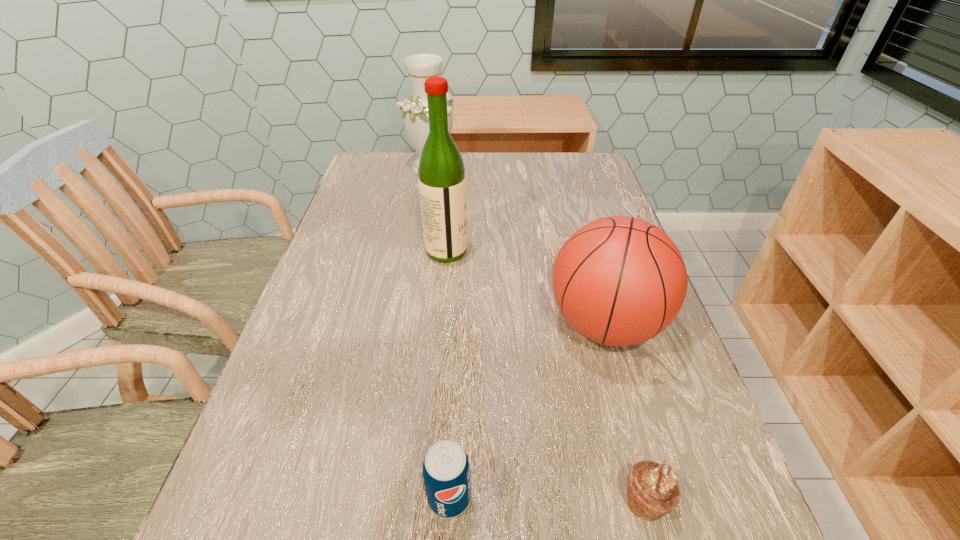
At what (x,y) coordinates should I click in order to perform the action: click on blank region between the tallest object and the pop. Please return your answer as a coordinate pair (x, y). Image resolution: width=960 pixels, height=540 pixels. Looking at the image, I should click on (448, 374).

Where is `free space between the vase and the third tallest object`? The height and width of the screenshot is (540, 960). free space between the vase and the third tallest object is located at coordinates (518, 246).

Identify the location of free space between the third tallest object and the shortest object. The image size is (960, 540). (625, 413).

The image size is (960, 540). Identify the location of object that ranks as the third closest to the liquor. (446, 469).

Select which object appears as the second closest to the pop. Please provide its 2D coordinates. Your answer should be formatted as a tuple, i.e. [(x, y)], where the tuple contains the x and y coordinates of a point satisfying the conditions above.

[(619, 280)]

You are a GUI agent. You are given a task and a screenshot of the screen. Output one action in this format:
    pyautogui.click(x=<x>, y=<y>)
    Task: Click on the free spot that satisfies the following two spatial constraints: 1. on the label of the third nearest object; 2. on the right side of the tallest object
    The width and height of the screenshot is (960, 540).
    Given the screenshot: What is the action you would take?
    [440, 325]

Where is `vacant space that satisfies the following two spatial constraints: 1. on the label of the pop; 2. on the left side of the tallest object`? vacant space that satisfies the following two spatial constraints: 1. on the label of the pop; 2. on the left side of the tallest object is located at coordinates (424, 497).

You are a GUI agent. You are given a task and a screenshot of the screen. Output one action in this format:
    pyautogui.click(x=<x>, y=<y>)
    Task: Click on the free space that satisfies the following two spatial constraints: 1. on the label of the tallest object; 2. on the back side of the third shortest object
    The width and height of the screenshot is (960, 540).
    Given the screenshot: What is the action you would take?
    pyautogui.click(x=440, y=325)

What are the coordinates of `free space that satisfies the following two spatial constraints: 1. on the front side of the third nearest object; 2. on the left side of the farthest object` in the screenshot? It's located at (405, 325).

Where is `free spot that satisfies the following two spatial constraints: 1. on the back side of the third tallest object; 2. on the left side of the pop`? This screenshot has height=540, width=960. free spot that satisfies the following two spatial constraints: 1. on the back side of the third tallest object; 2. on the left side of the pop is located at coordinates (458, 325).